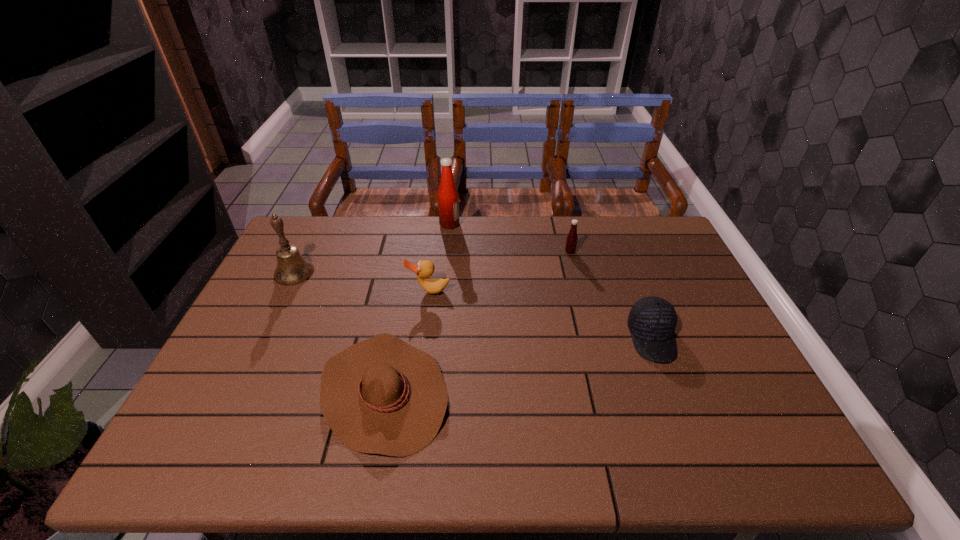
Find the location of a particular element. This screenshot has height=540, width=960. free space at the left edge of the desktop is located at coordinates (254, 341).

Find the location of a particular element. This screenshot has width=960, height=540. vacant area at the right edge of the desktop is located at coordinates (706, 415).

The width and height of the screenshot is (960, 540). What are the coordinates of `blank space at the far left corner of the desktop` in the screenshot? It's located at (301, 233).

At what (x,y) coordinates should I click in order to perform the action: click on vacant area at the far right corner. Please return your answer as a coordinate pair (x, y). Looking at the image, I should click on (661, 255).

Locate an element on the screen. This screenshot has height=540, width=960. free space between the duck and the shortest object is located at coordinates click(x=406, y=342).

This screenshot has height=540, width=960. Find the location of `unoccupied area between the shortest object and the rightmost object`. unoccupied area between the shortest object and the rightmost object is located at coordinates (517, 365).

Where is `free space between the duck and the rightmost object`? The height and width of the screenshot is (540, 960). free space between the duck and the rightmost object is located at coordinates (540, 314).

Locate an element on the screen. This screenshot has height=540, width=960. free space between the rightmost object and the condiment is located at coordinates (551, 281).

I want to click on free space between the duck and the rightmost object, so coord(540,314).

Find the location of a particular element. The image size is (960, 540). unoccupied area between the second farthest object and the cowboy hat is located at coordinates (477, 322).